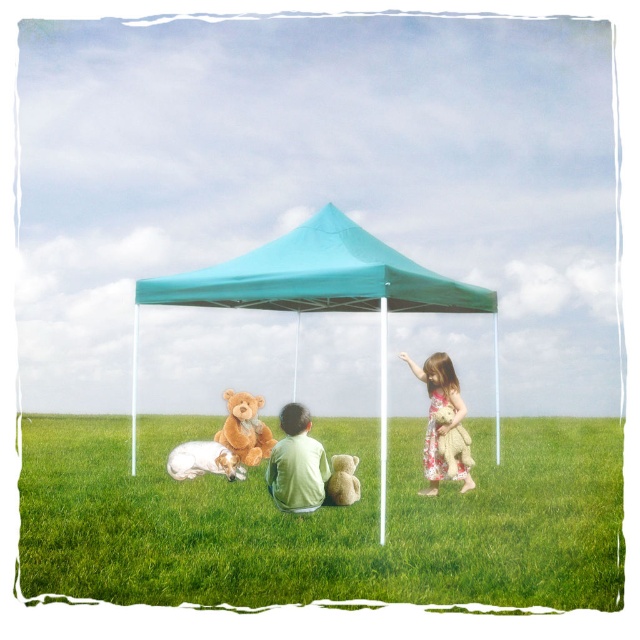
Does light green fabric at center appear over white fur dog at lower center?

Correct, light green fabric at center is located above white fur dog at lower center.

Looking at this image, can you confirm if light green fabric at center is positioned to the right of white fur dog at lower center?

Correct, you'll find light green fabric at center to the right of white fur dog at lower center.

This screenshot has width=640, height=640. Find the location of `light green fabric at center`. light green fabric at center is located at coordinates (296, 464).

Find the location of a particular element. light green fabric at center is located at coordinates (296, 464).

Does fuzzy beige teddy bear at lower right have a larger size compared to fuzzy beige teddy bear at lower center?

Indeed, fuzzy beige teddy bear at lower right has a larger size compared to fuzzy beige teddy bear at lower center.

Describe the element at coordinates (454, 449) in the screenshot. I see `fuzzy beige teddy bear at lower right` at that location.

Between point (444, 449) and point (356, 486), which one is positioned in front?

Point (356, 486) is more forward.

You are a GUI agent. You are given a task and a screenshot of the screen. Output one action in this format:
    pyautogui.click(x=<x>, y=<y>)
    Task: Click on the fuzzy beige teddy bear at lower right
    This screenshot has width=640, height=640.
    Given the screenshot: What is the action you would take?
    pyautogui.click(x=454, y=449)

Between white fur dog at lower center and fuzzy beige teddy bear at lower right, which one has less height?

white fur dog at lower center

Locate an element on the screen. This screenshot has width=640, height=640. white fur dog at lower center is located at coordinates tap(204, 460).